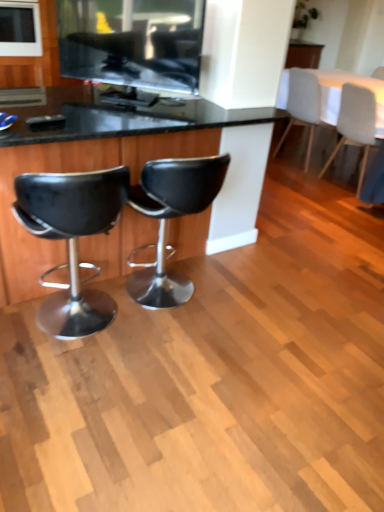
Where is `vacant space in front of black leather stool at left, which is the 4th chair from back to front`? vacant space in front of black leather stool at left, which is the 4th chair from back to front is located at coordinates (69, 398).